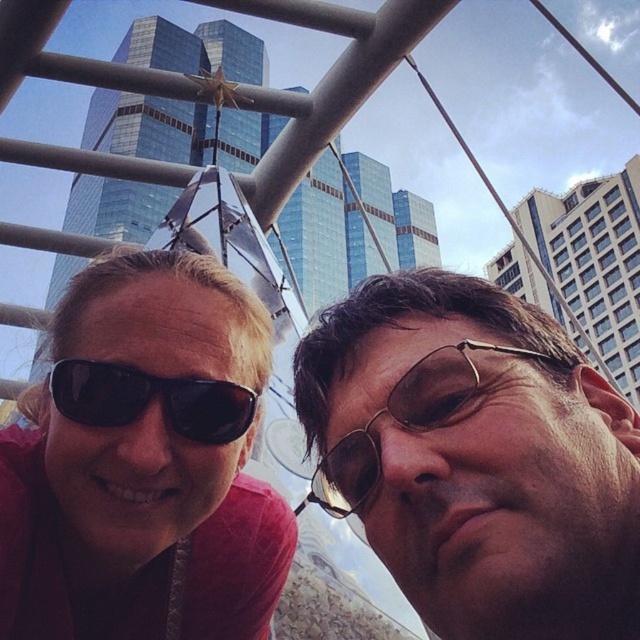
Between metallic sunglasses at center and black matte sunglasses at left, which one is positioned lower?

metallic sunglasses at center is lower down.

Is metallic sunglasses at center to the left of black matte sunglasses at left from the viewer's perspective?

In fact, metallic sunglasses at center is to the right of black matte sunglasses at left.

Between point (490, 317) and point (220, 392), which one is positioned in front?

Point (490, 317)

At what (x,y) coordinates should I click in order to perform the action: click on metallic sunglasses at center. Please return your answer as a coordinate pair (x, y). Looking at the image, I should click on (476, 458).

Does metallic sunglasses at center have a greater height compared to metallic gold sunglasses at center?

Incorrect, metallic sunglasses at center's height is not larger of metallic gold sunglasses at center's.

Is point (486, 378) positioned after point (444, 403)?

No, it is in front of (444, 403).

At what (x,y) coordinates should I click in order to perform the action: click on metallic sunglasses at center. Please return your answer as a coordinate pair (x, y). Looking at the image, I should click on (476, 458).

Is matte black sunglasses at center wider than black matte sunglasses at left?

Correct, the width of matte black sunglasses at center exceeds that of black matte sunglasses at left.

Is point (198, 524) positioned after point (164, 388)?

Yes, point (198, 524) is farther from viewer.

Find the location of a particular element. The image size is (640, 640). matte black sunglasses at center is located at coordinates (145, 461).

This screenshot has width=640, height=640. What are the coordinates of `matte black sunglasses at center` in the screenshot? It's located at (145, 461).